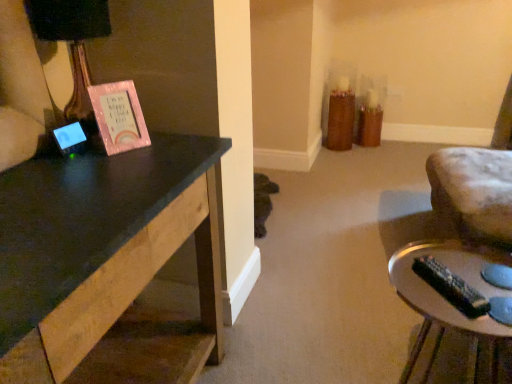
Question: Can you confirm if matte black lampshade at left is positioned to the left of silver metallic remote control at lower right?

Choices:
 (A) no
 (B) yes

Answer: (B)

Question: Can you confirm if matte black lampshade at left is smaller than silver metallic remote control at lower right?

Choices:
 (A) no
 (B) yes

Answer: (B)

Question: Can you confirm if matte black lampshade at left is thinner than silver metallic remote control at lower right?

Choices:
 (A) no
 (B) yes

Answer: (B)

Question: Is matte black lampshade at left far away from silver metallic remote control at lower right?

Choices:
 (A) no
 (B) yes

Answer: (B)

Question: From the image's perspective, would you say matte black lampshade at left is shown under silver metallic remote control at lower right?

Choices:
 (A) yes
 (B) no

Answer: (B)

Question: Is matte black lampshade at left bigger than silver metallic remote control at lower right?

Choices:
 (A) yes
 (B) no

Answer: (B)

Question: Considering the relative sizes of silver metallic remote control at lower right and matte black lampshade at left in the image provided, is silver metallic remote control at lower right taller than matte black lampshade at left?

Choices:
 (A) no
 (B) yes

Answer: (B)

Question: From the image's perspective, is silver metallic remote control at lower right below matte black lampshade at left?

Choices:
 (A) yes
 (B) no

Answer: (A)

Question: Considering the relative sizes of silver metallic remote control at lower right and matte black lampshade at left in the image provided, is silver metallic remote control at lower right thinner than matte black lampshade at left?

Choices:
 (A) yes
 (B) no

Answer: (B)

Question: Considering the relative sizes of silver metallic remote control at lower right and matte black lampshade at left in the image provided, is silver metallic remote control at lower right smaller than matte black lampshade at left?

Choices:
 (A) yes
 (B) no

Answer: (B)

Question: From a real-world perspective, is silver metallic remote control at lower right located higher than matte black lampshade at left?

Choices:
 (A) no
 (B) yes

Answer: (A)

Question: Considering the relative positions of silver metallic remote control at lower right and matte black lampshade at left in the image provided, is silver metallic remote control at lower right to the right of matte black lampshade at left from the viewer's perspective?

Choices:
 (A) no
 (B) yes

Answer: (B)

Question: Is matte black lampshade at left situated inside silver metallic remote control at lower right or outside?

Choices:
 (A) outside
 (B) inside

Answer: (A)